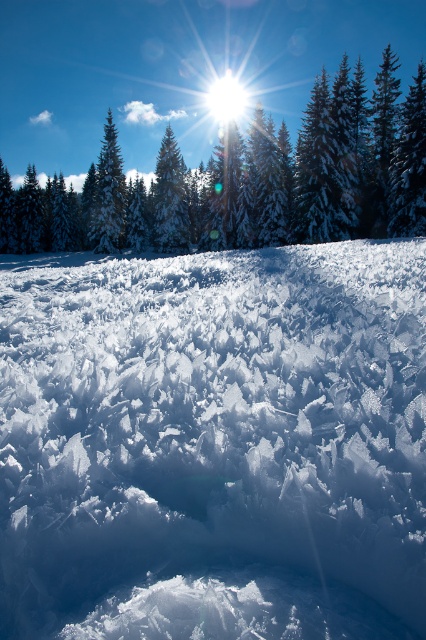
Question: Based on their relative distances, which object is farther from the green matte tree at upper center?

Choices:
 (A) green matte tree at center
 (B) white crystalline snow at center

Answer: (B)

Question: Does green matte tree at upper center have a greater width compared to green matte tree at center?

Choices:
 (A) no
 (B) yes

Answer: (B)

Question: Which object is the closest to the green frosted pine at upper center?

Choices:
 (A) white crystalline snow at center
 (B) green matte tree at center
 (C) green matte tree at upper center

Answer: (C)

Question: Is green frosted pine at upper center further to camera compared to green matte tree at center?

Choices:
 (A) yes
 (B) no

Answer: (B)

Question: Based on their relative distances, which object is nearer to the white crystalline snow at center?

Choices:
 (A) green matte tree at upper center
 (B) green frosted pine at upper center
 (C) green matte tree at center

Answer: (C)

Question: Is green matte tree at upper center bigger than green matte tree at center?

Choices:
 (A) yes
 (B) no

Answer: (A)